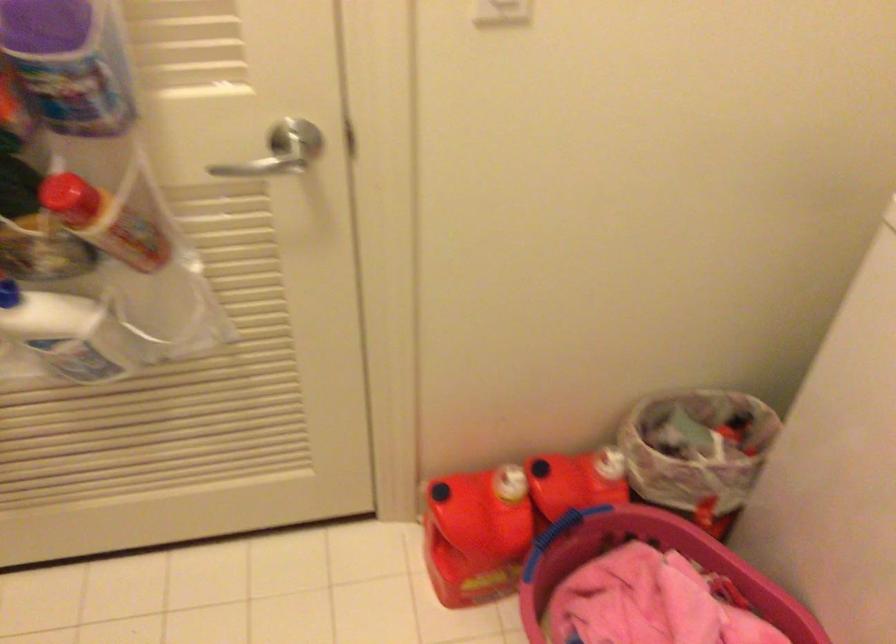
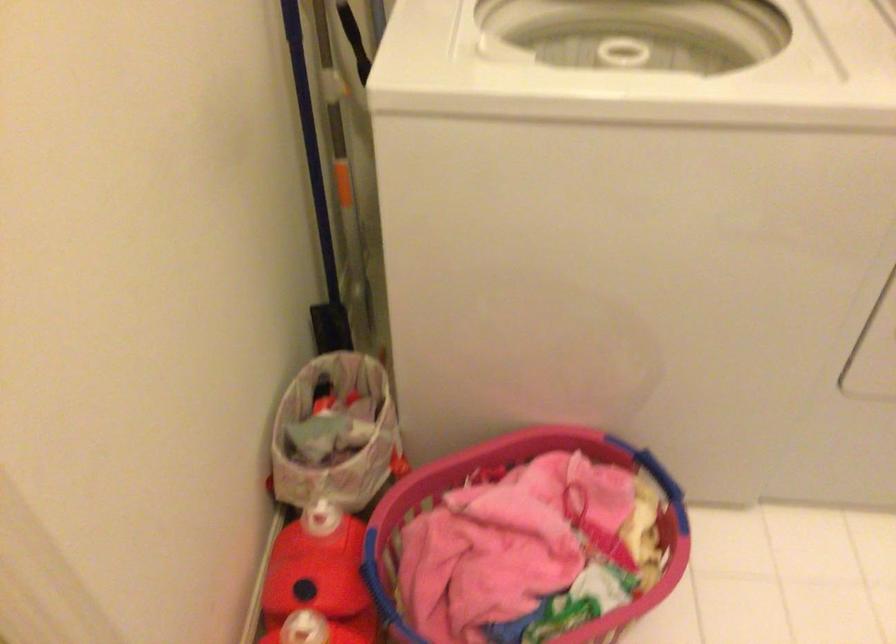
How did the camera likely rotate?

The camera's rotation is toward right-down.